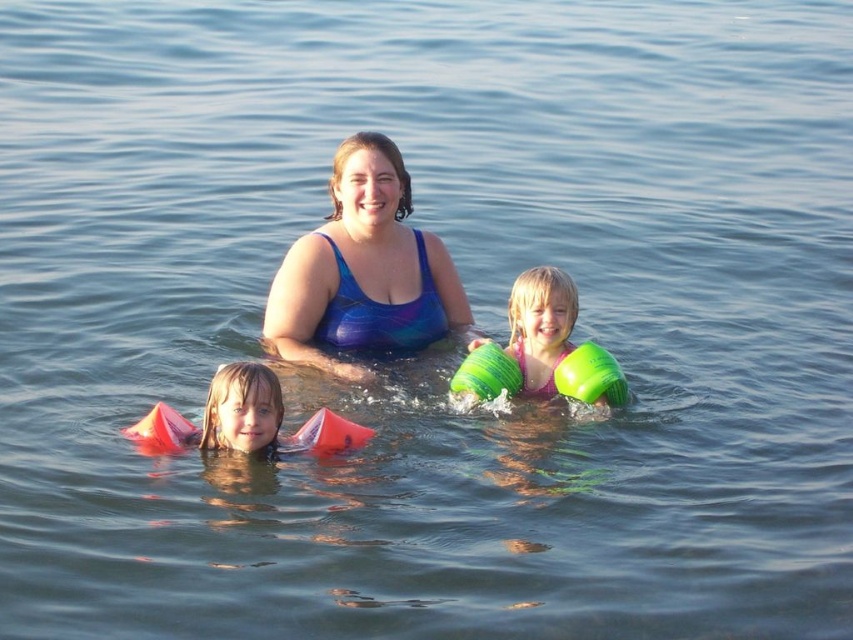
Is point (421, 296) positioned before point (605, 355)?

No, (421, 296) is further to viewer.

Can you confirm if blue shiny swimsuit at center is positioned to the right of green rubber arm bands at center?

In fact, blue shiny swimsuit at center is to the left of green rubber arm bands at center.

This screenshot has width=853, height=640. What do you see at coordinates (363, 269) in the screenshot?
I see `blue shiny swimsuit at center` at bounding box center [363, 269].

I want to click on blue shiny swimsuit at center, so click(363, 269).

Is green rubber arm bands at center smaller than matte orange floaties at lower left?

No.

Which is more to the right, green rubber arm bands at center or matte orange floaties at lower left?

Positioned to the right is green rubber arm bands at center.

Identify the location of green rubber arm bands at center. (555, 340).

Who is higher up, blue shiny swimsuit at center or matte orange floaties at lower left?

blue shiny swimsuit at center is above.

Does blue shiny swimsuit at center lie behind matte orange floaties at lower left?

That is True.

At what (x,y) coordinates should I click in order to perform the action: click on blue shiny swimsuit at center. Please return your answer as a coordinate pair (x, y). Looking at the image, I should click on (363, 269).